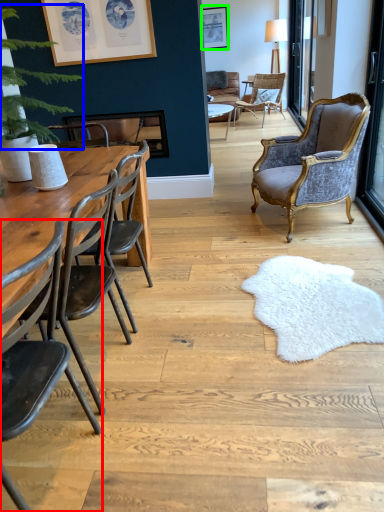
Question: Which object is the farthest from chair (highlighted by a red box)? Choose among these: plant (highlighted by a blue box) or picture frame (highlighted by a green box).

Choices:
 (A) plant
 (B) picture frame

Answer: (B)